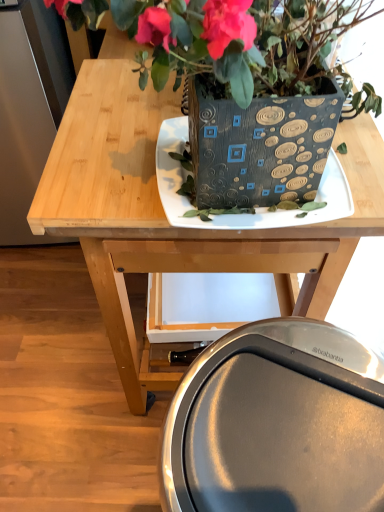
I want to click on blank area to the left of matte black plate at center, so click(105, 167).